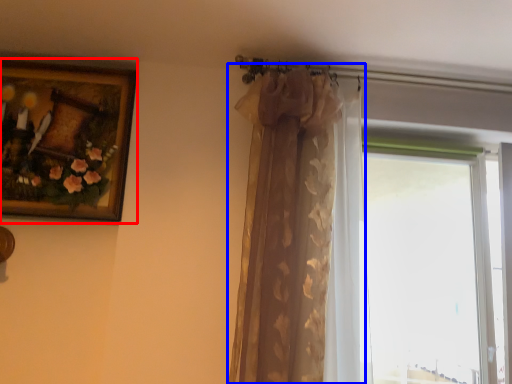
Question: Among these objects, which one is farthest to the camera, picture frame (highlighted by a red box) or curtain (highlighted by a blue box)?

Choices:
 (A) picture frame
 (B) curtain

Answer: (A)